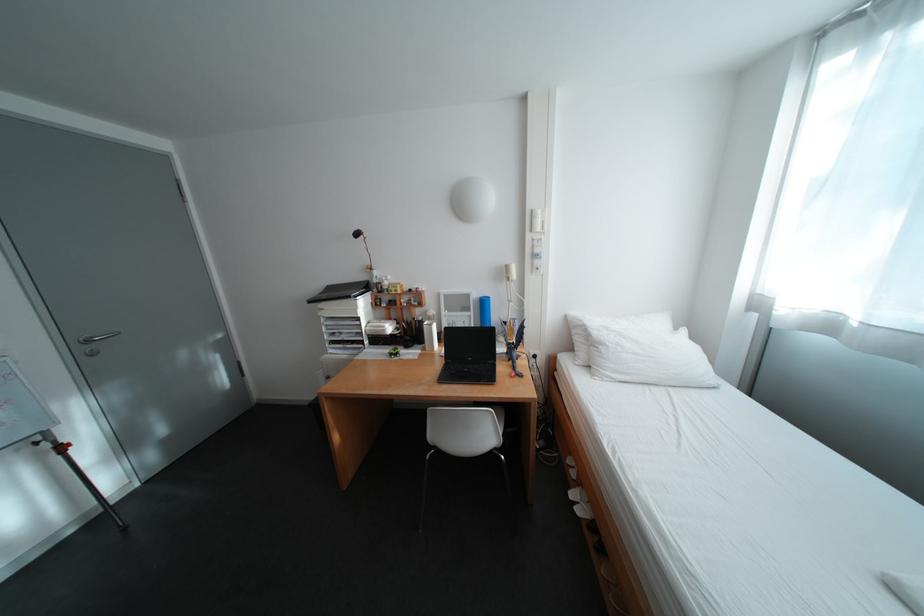
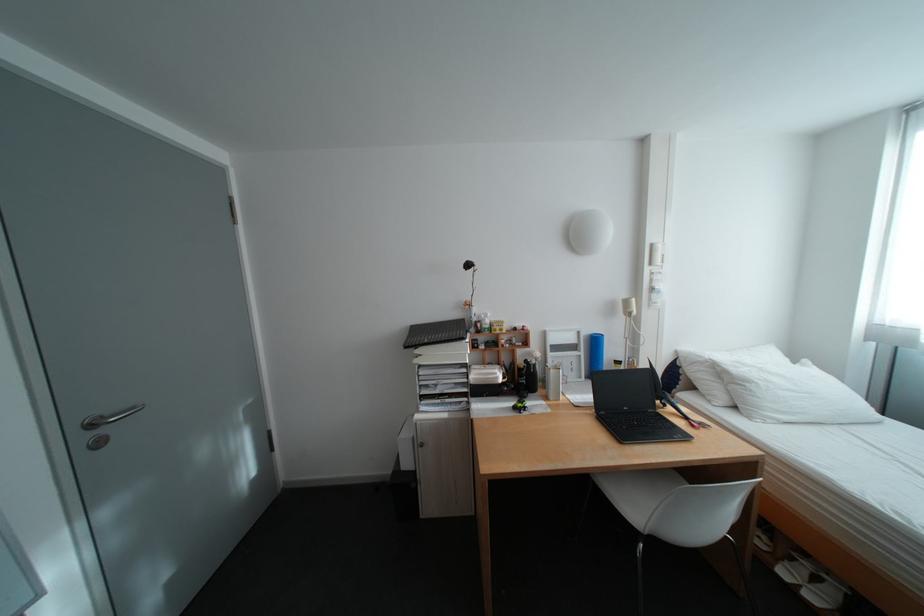
Where in the second image is the point corresponding to point 444,315 from the first image?

(552, 358)